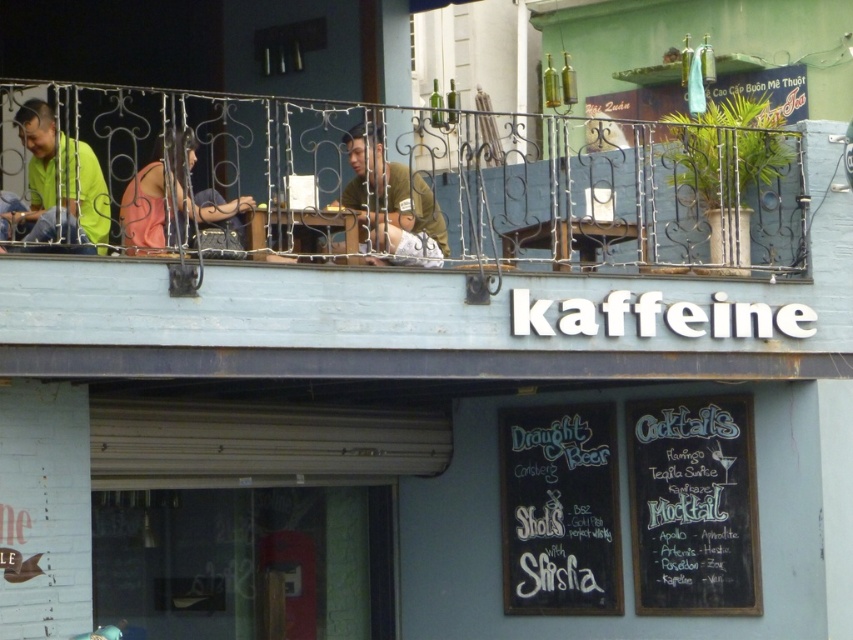
You are standing outside the building and want to know if the blue wooden balcony at upper center is above the black chalkboard at lower right. Can you confirm this?

Yes, the blue wooden balcony at upper center is positioned over the black chalkboard at lower right according to the description.

You are a customer looking at the storefront of kaffeine. You see a black chalkboard at lower right and a green matte shirt at center. Which object is larger in size?

The black chalkboard at lower right is bigger than the green matte shirt at center.

You are a customer standing in front of the storefront of kaffeine. You see the black chalkboard at lower right and the green matte shirt at center. Which object is closer to the ground?

The black chalkboard at lower right is positioned under the green matte shirt at center, so it is closer to the ground.